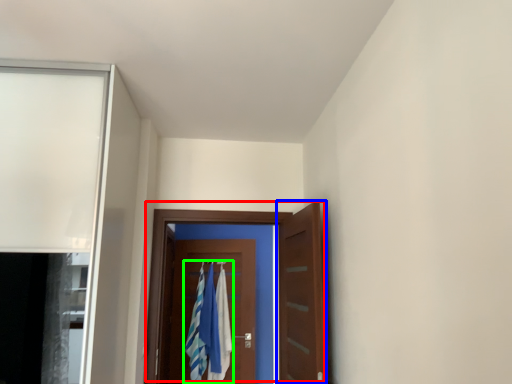
Question: Which object is the closest to the door (highlighted by a red box)? Choose among these: door (highlighted by a blue box) or laundry (highlighted by a green box).

Choices:
 (A) door
 (B) laundry

Answer: (A)